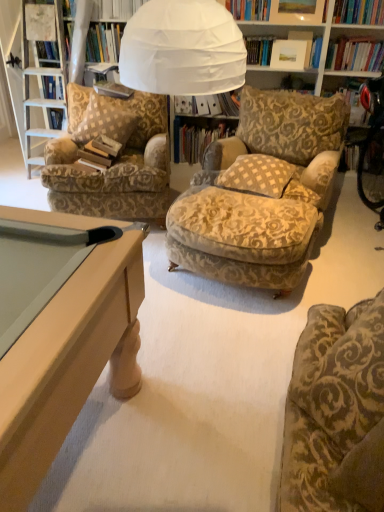
Question: From the image's perspective, is white paper book at center, placed as the second book when sorted from back to front, positioned above or below hardcover book at center, which is counted as the 3th book, starting from the back?

Choices:
 (A) below
 (B) above

Answer: (B)

Question: Based on their positions, is white paper book at center, the third book viewed from the front, located to the left or right of hardcover book at center, which is counted as the 3th book, starting from the back?

Choices:
 (A) left
 (B) right

Answer: (B)

Question: Which is nearer to the brown paper book at center, arranged as the 4th book when viewed from the back?

Choices:
 (A) patterned fabric pillow at left, which is the first pillow in left-to-right order
 (B) hardcover book at center, which is counted as the 3th book, starting from the back
 (C) white paper book at center, the third book viewed from the front
 (D) checkered fabric pillow at center, which is counted as the first pillow, starting from the right
 (E) patterned fabric armchair at left, placed as the first chair when sorted from top to bottom

Answer: (A)

Question: Estimate the real-world distances between objects in this image. Which object is closer to the velvet gold-patterned chair at lower right, which is the 2th chair in back-to-front order?

Choices:
 (A) checkered fabric pillow at center, which is counted as the second pillow, starting from the left
 (B) brown paper book at center, marked as the first book in a front-to-back arrangement
 (C) hardcover book at center, the 4th book from the front
 (D) patterned fabric armchair at left, the 2th chair from the right
 (E) hardcover book at center, the 2th book when ordered from front to back

Answer: (A)